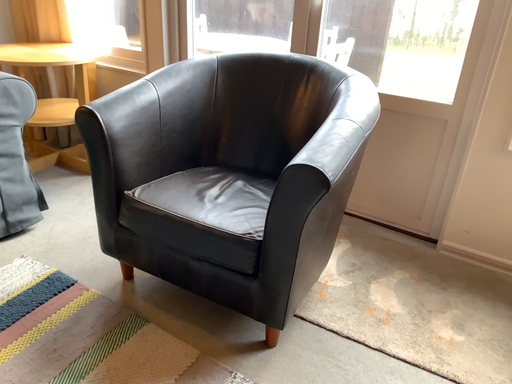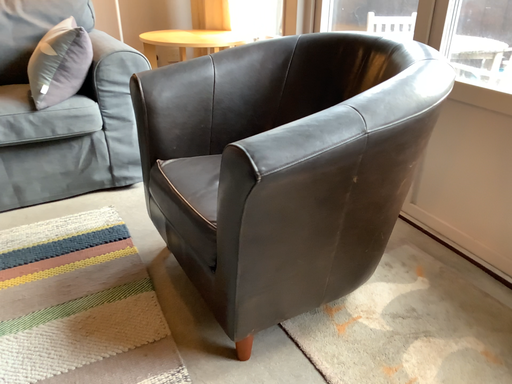
Question: How did the camera likely rotate when shooting the video?

Choices:
 (A) rotated right
 (B) rotated left

Answer: (B)